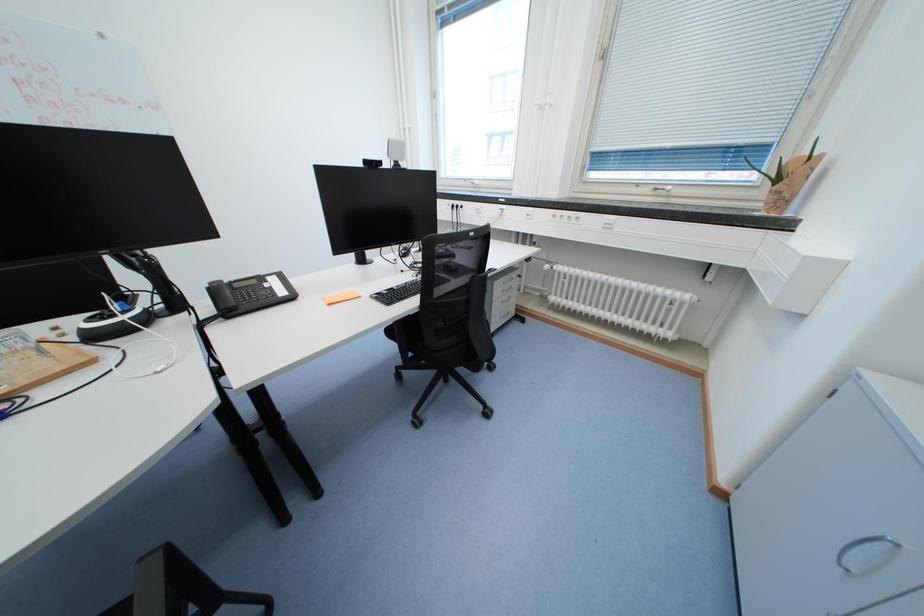
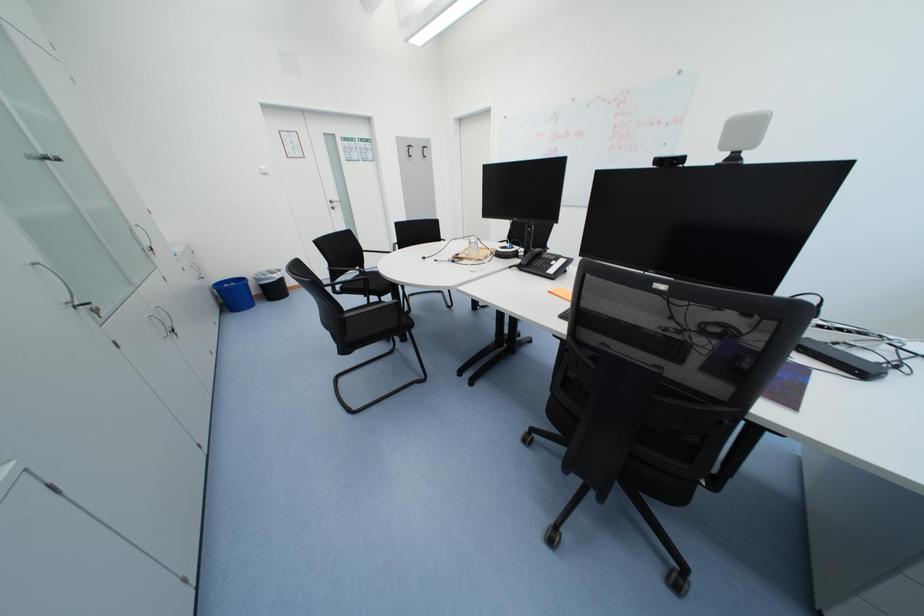
Based on the continuous images, in which direction is the camera rotating?

The camera's rotation is toward left-down.